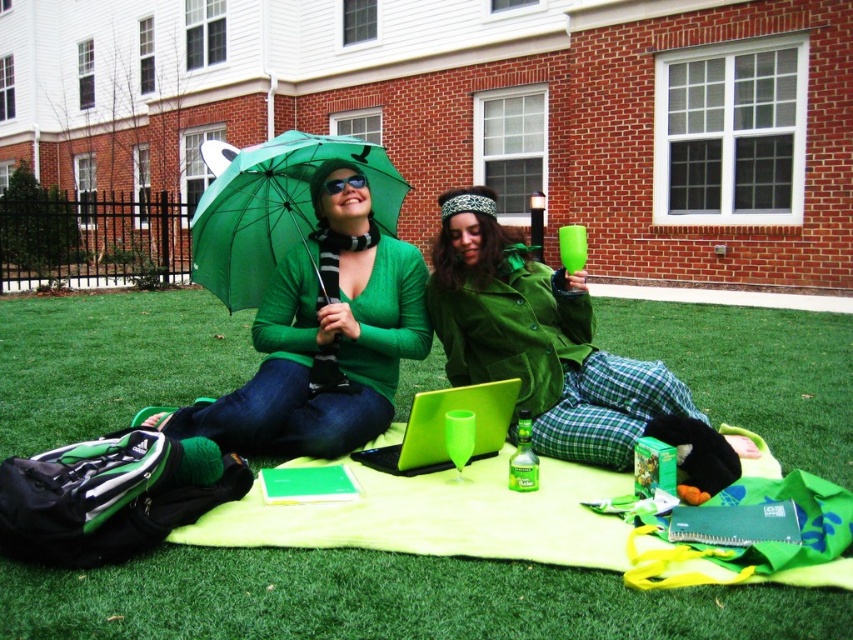
Does green grass at center appear on the left side of matte green laptop at center?

Yes, green grass at center is to the left of matte green laptop at center.

Identify the location of green grass at center. (387, 600).

Is green grass at center behind green matte jacket at center?

No.

What do you see at coordinates (387, 600) in the screenshot?
I see `green grass at center` at bounding box center [387, 600].

Which is behind, point (65, 436) or point (587, 435)?

Positioned behind is point (65, 436).

The height and width of the screenshot is (640, 853). What are the coordinates of `green grass at center` in the screenshot? It's located at (387, 600).

Does green grass at center appear on the right side of matte green sweater at center?

Yes, green grass at center is to the right of matte green sweater at center.

Does green grass at center have a lesser height compared to matte green sweater at center?

Correct, green grass at center is not as tall as matte green sweater at center.

You are a GUI agent. You are given a task and a screenshot of the screen. Output one action in this format:
    pyautogui.click(x=<x>, y=<y>)
    Task: Click on the green grass at center
    
    Given the screenshot: What is the action you would take?
    pyautogui.click(x=387, y=600)

What are the coordinates of `green grass at center` in the screenshot? It's located at (387, 600).